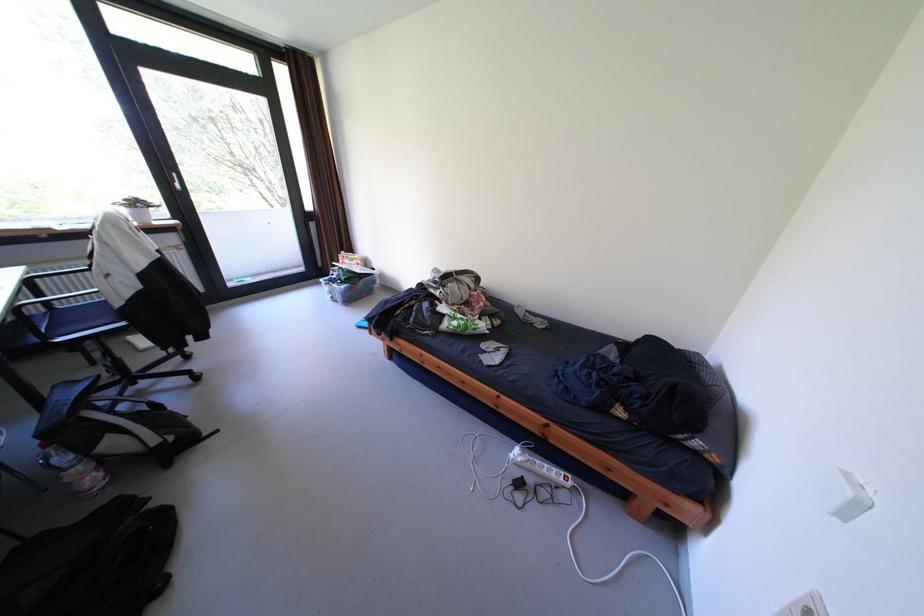
At what (x,y) coordinates should I click in order to perform the action: click on white wall switch. Please return your answer as a coordinate pair (x, y). Looking at the image, I should click on (805, 605).